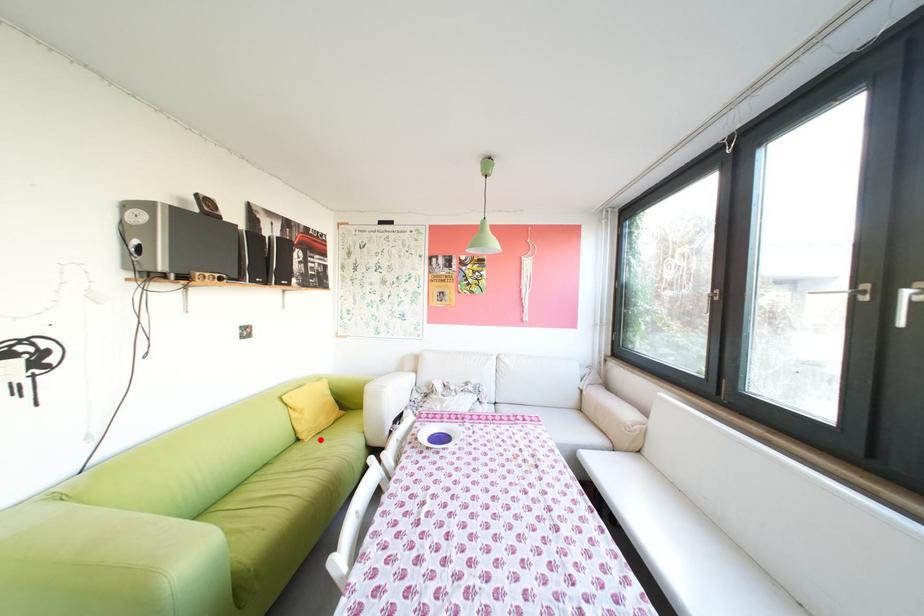
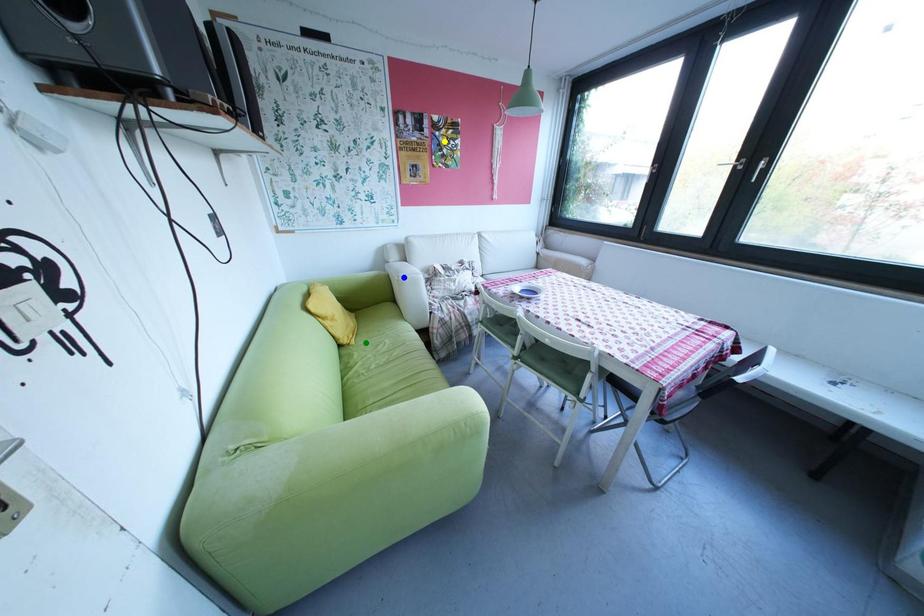
Question: I am providing you with two images of the same scene from different viewpoints. A red point is marked on the first image. You are given multiple points on the second image. In image 2, which mark is for the same physical point as the one in image 1?

Choices:
 (A) yellow point
 (B) blue point
 (C) green point

Answer: (C)